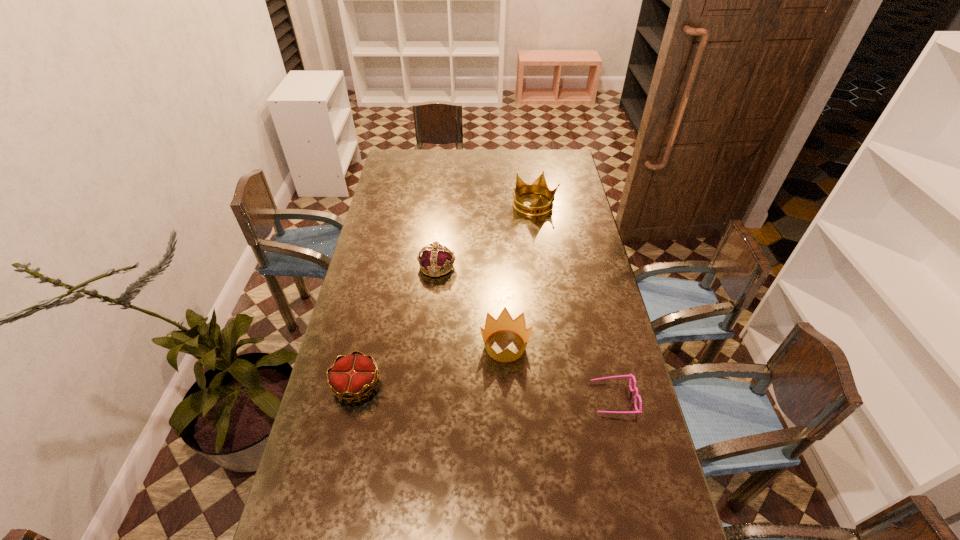
The height and width of the screenshot is (540, 960). I want to click on vacant area that lies between the second shortest object and the farthest object, so click(x=445, y=295).

Identify the location of blank region between the farthest crown and the shortest crown. The width and height of the screenshot is (960, 540). (445, 295).

Identify the location of free point between the third crown from right to left and the farthest crown. (486, 235).

In order to click on free space that is in between the fourth nearest object and the second shortest object in this screenshot , I will do `click(396, 326)`.

You are a GUI agent. You are given a task and a screenshot of the screen. Output one action in this format:
    pyautogui.click(x=<x>, y=<y>)
    Task: Click on the object that stands as the second closest to the second shortest object
    This screenshot has width=960, height=540.
    Given the screenshot: What is the action you would take?
    pyautogui.click(x=435, y=257)

Locate an element on the screen. object that ranks as the second closest to the second shortest object is located at coordinates (435, 257).

The width and height of the screenshot is (960, 540). Identify the location of crown that is the second closest one to the farthest object. (504, 321).

Select which crown is the fourth closest to the shortest object. Please provide its 2D coordinates. Your answer should be formatted as a tuple, i.e. [(x, y)], where the tuple contains the x and y coordinates of a point satisfying the conditions above.

[(539, 186)]

At what (x,y) coordinates should I click in order to perform the action: click on vacant point that satisfies the following two spatial constraints: 1. on the back side of the fourth object from right to left; 2. on the left side of the farthest object. Please return your answer as a coordinate pair (x, y). Image resolution: width=960 pixels, height=540 pixels. Looking at the image, I should click on (443, 205).